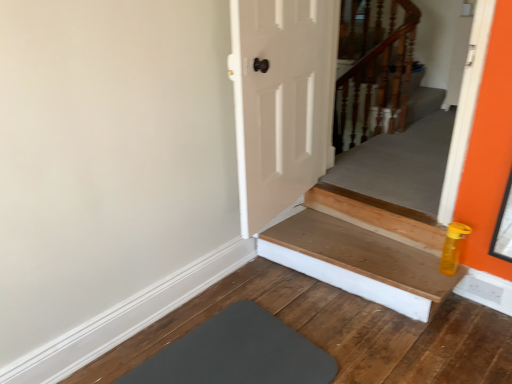
I want to click on free space to the left of wooden at bottom, so click(251, 313).